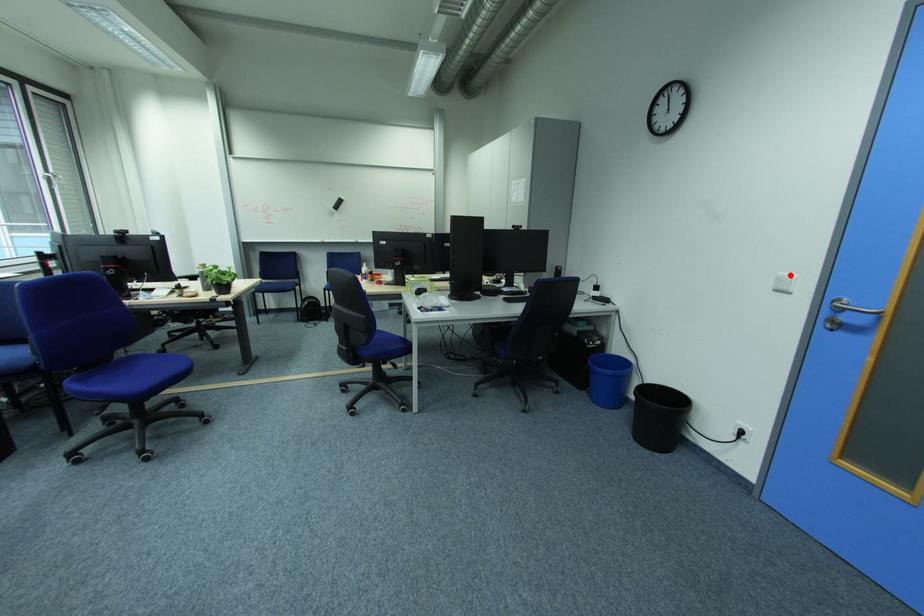
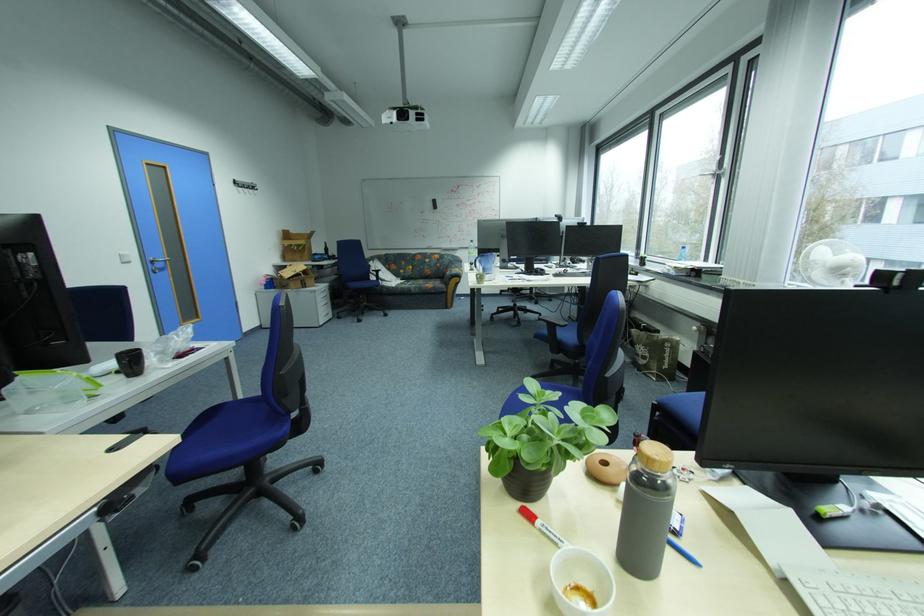
The point at the highlighted location is marked in the first image. Where is the corresponding point in the second image?

(130, 254)